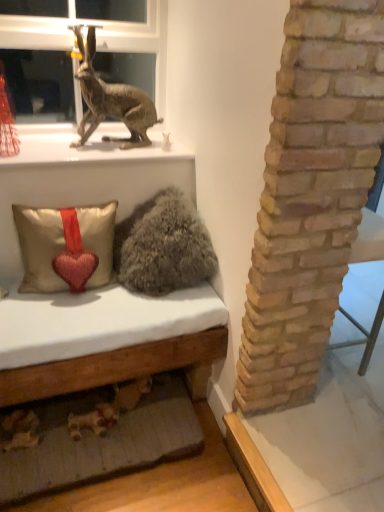
Question: Can you confirm if metallic rabbit at upper left is smaller than metallic gold statue at upper left?

Choices:
 (A) no
 (B) yes

Answer: (A)

Question: From the image's perspective, is metallic rabbit at upper left on top of metallic gold statue at upper left?

Choices:
 (A) yes
 (B) no

Answer: (A)

Question: Does metallic rabbit at upper left have a greater height compared to metallic gold statue at upper left?

Choices:
 (A) no
 (B) yes

Answer: (B)

Question: From the image's perspective, is metallic rabbit at upper left under metallic gold statue at upper left?

Choices:
 (A) yes
 (B) no

Answer: (B)

Question: From a real-world perspective, is metallic rabbit at upper left over metallic gold statue at upper left?

Choices:
 (A) no
 (B) yes

Answer: (B)

Question: Can you confirm if metallic rabbit at upper left is positioned to the right of metallic gold statue at upper left?

Choices:
 (A) yes
 (B) no

Answer: (B)

Question: Could you tell me if satin beige pillow with heart at lower left is turned towards metallic rabbit at upper left?

Choices:
 (A) no
 (B) yes

Answer: (A)

Question: Can you confirm if satin beige pillow with heart at lower left is positioned to the right of metallic rabbit at upper left?

Choices:
 (A) no
 (B) yes

Answer: (A)

Question: From the image's perspective, is satin beige pillow with heart at lower left located beneath metallic rabbit at upper left?

Choices:
 (A) yes
 (B) no

Answer: (A)

Question: Considering the relative sizes of satin beige pillow with heart at lower left and metallic rabbit at upper left in the image provided, is satin beige pillow with heart at lower left taller than metallic rabbit at upper left?

Choices:
 (A) no
 (B) yes

Answer: (A)

Question: Does satin beige pillow with heart at lower left have a larger size compared to metallic rabbit at upper left?

Choices:
 (A) yes
 (B) no

Answer: (A)

Question: From a real-world perspective, does satin beige pillow with heart at lower left stand above metallic rabbit at upper left?

Choices:
 (A) yes
 (B) no

Answer: (B)

Question: Is satin beige pillow with heart at lower left surrounded by fuzzy gray pillow at center?

Choices:
 (A) yes
 (B) no

Answer: (B)